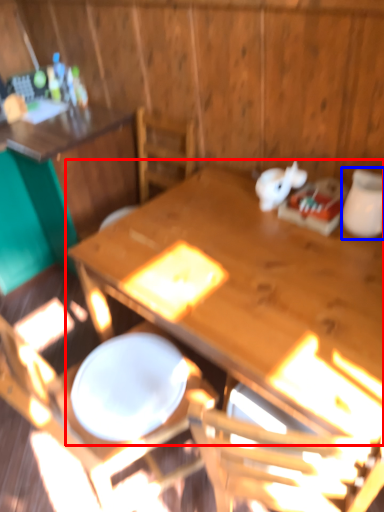
Question: Which object appears closest to the camera in this image, table (highlighted by a red box) or tableware (highlighted by a blue box)?

Choices:
 (A) table
 (B) tableware

Answer: (A)